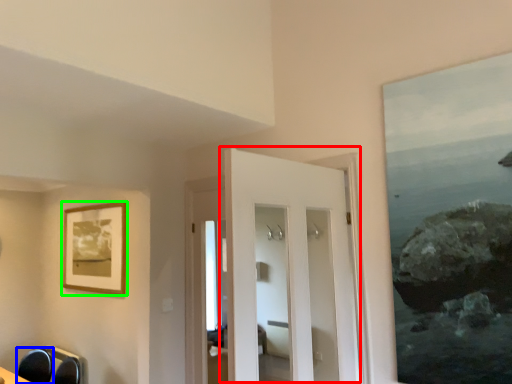
Question: Which object is the farthest from door (highlighted by a red box)? Choose among these: swivel chair (highlighted by a blue box) or picture frame (highlighted by a green box).

Choices:
 (A) swivel chair
 (B) picture frame

Answer: (A)